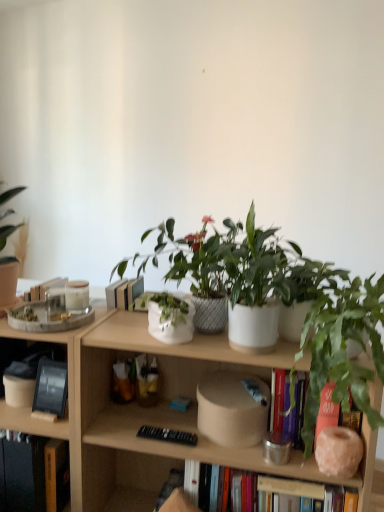
Question: Is the position of black matte tablet at left, which ranks as the 2th book in bottom-to-top order, less distant than that of green matte houseplant at right?

Choices:
 (A) no
 (B) yes

Answer: (A)

Question: Is black matte tablet at left, the first book when ordered from top to bottom, located outside green matte houseplant at right?

Choices:
 (A) no
 (B) yes

Answer: (B)

Question: Is green matte houseplant at right at the back of black matte tablet at left, which ranks as the 2th book in bottom-to-top order?

Choices:
 (A) yes
 (B) no

Answer: (B)

Question: From the image's perspective, would you say black matte tablet at left, the first book when ordered from top to bottom, is shown under green matte houseplant at right?

Choices:
 (A) no
 (B) yes

Answer: (B)

Question: Would you say green matte houseplant at right is part of black matte tablet at left, which ranks as the 2th book in bottom-to-top order,'s contents?

Choices:
 (A) yes
 (B) no

Answer: (B)

Question: Is green matte houseplant at right to the left or to the right of black matte tablet at left, which ranks as the 2th book in bottom-to-top order, in the image?

Choices:
 (A) right
 (B) left

Answer: (A)

Question: Relative to black matte tablet at left, the first book when ordered from top to bottom, is green matte houseplant at right in front or behind?

Choices:
 (A) behind
 (B) front

Answer: (B)

Question: Based on their sizes in the image, would you say green matte houseplant at right is bigger or smaller than black matte tablet at left, the first book when ordered from top to bottom?

Choices:
 (A) big
 (B) small

Answer: (A)

Question: Choose the correct answer: Is green matte houseplant at right inside black matte tablet at left, which ranks as the 2th book in bottom-to-top order, or outside it?

Choices:
 (A) inside
 (B) outside

Answer: (B)

Question: Looking at their shapes, would you say wooden bookcase at center is wider or thinner than hardcover book at lower left, arranged as the 2th book when viewed from the top?

Choices:
 (A) thin
 (B) wide

Answer: (B)

Question: From their relative heights in the image, would you say wooden bookcase at center is taller or shorter than hardcover book at lower left, arranged as the first book when ordered from the bottom?

Choices:
 (A) tall
 (B) short

Answer: (A)

Question: From the image's perspective, is wooden bookcase at center positioned above or below hardcover book at lower left, arranged as the first book when ordered from the bottom?

Choices:
 (A) below
 (B) above

Answer: (B)

Question: Is wooden bookcase at center to the left or to the right of hardcover book at lower left, arranged as the first book when ordered from the bottom, in the image?

Choices:
 (A) right
 (B) left

Answer: (A)

Question: From a real-world perspective, is green matte houseplant at right positioned above or below wooden bookcase at center?

Choices:
 (A) below
 (B) above

Answer: (B)

Question: Does point (365, 283) appear closer or farther from the camera than point (180, 417)?

Choices:
 (A) closer
 (B) farther

Answer: (A)